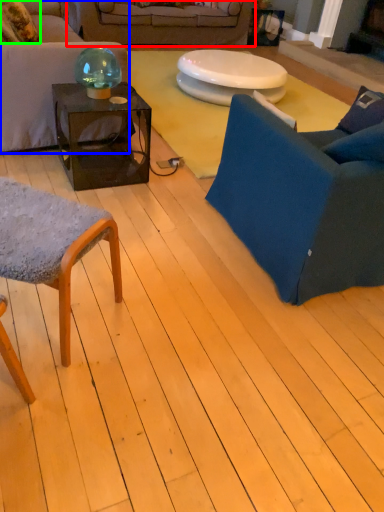
Question: Estimate the real-world distances between objects in this image. Which object is closer to studio couch (highlighted by a red box), studio couch (highlighted by a blue box) or pillow (highlighted by a green box)?

Choices:
 (A) studio couch
 (B) pillow

Answer: (B)